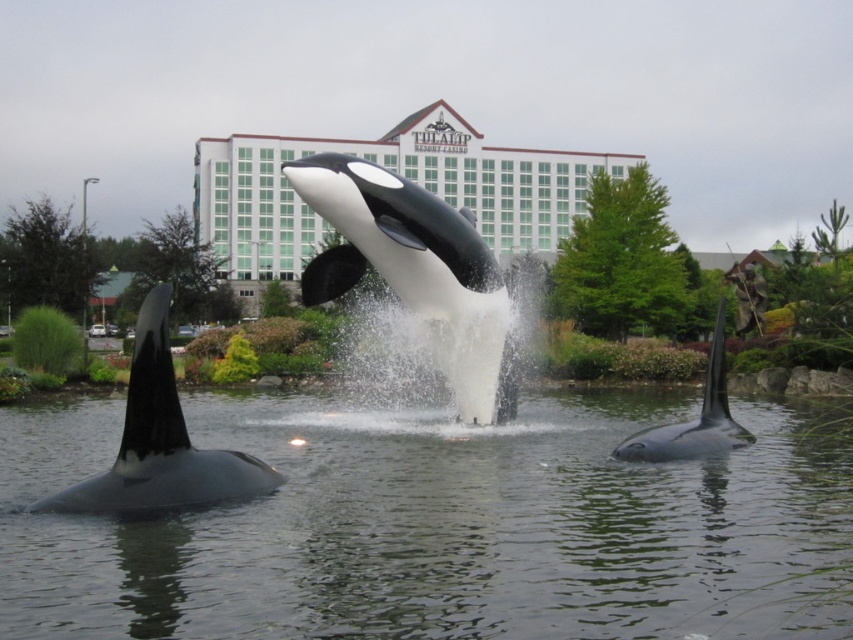
Question: Which of these objects is positioned farthest from the black matte orca at right?

Choices:
 (A) black matte orca at left
 (B) black and white plastic orca at center
 (C) clear water at center

Answer: (A)

Question: Does clear water at center appear under black and white plastic orca at center?

Choices:
 (A) yes
 (B) no

Answer: (A)

Question: Does black and white plastic orca at center lie in front of black matte orca at right?

Choices:
 (A) yes
 (B) no

Answer: (B)

Question: Is clear water at center positioned before black matte orca at left?

Choices:
 (A) no
 (B) yes

Answer: (B)

Question: Which object is farther from the camera taking this photo?

Choices:
 (A) black matte orca at left
 (B) black matte orca at right

Answer: (B)

Question: Which is farther from the black matte orca at left?

Choices:
 (A) black matte orca at right
 (B) black and white plastic orca at center
 (C) clear water at center

Answer: (B)